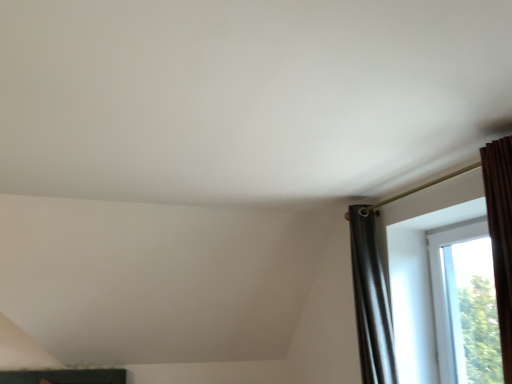
Question: From a real-world perspective, is transparent glass window at right, which appears as the 1th window when viewed from the left, over transparent glass window at right, the 1th window when ordered from right to left?

Choices:
 (A) yes
 (B) no

Answer: (A)

Question: Considering the relative positions of transparent glass window at right, which appears as the 1th window when viewed from the left, and transparent glass window at right, the 1th window when ordered from right to left, in the image provided, is transparent glass window at right, which appears as the 1th window when viewed from the left, in front of transparent glass window at right, the 1th window when ordered from right to left,?

Choices:
 (A) yes
 (B) no

Answer: (A)

Question: Does transparent glass window at right, which appears as the 1th window when viewed from the left, have a lesser height compared to transparent glass window at right, the 1th window when ordered from right to left?

Choices:
 (A) yes
 (B) no

Answer: (B)

Question: Is transparent glass window at right, which ranks as the 2th window in right-to-left order, smaller than transparent glass window at right, the 2th window in the left-to-right sequence?

Choices:
 (A) no
 (B) yes

Answer: (A)

Question: Is transparent glass window at right, which appears as the 1th window when viewed from the left, further to the viewer compared to transparent glass window at right, the 1th window when ordered from right to left?

Choices:
 (A) yes
 (B) no

Answer: (B)

Question: Is transparent glass window at right, which appears as the 1th window when viewed from the left, thinner than transparent glass window at right, the 1th window when ordered from right to left?

Choices:
 (A) yes
 (B) no

Answer: (A)

Question: Does transparent glass window at right, the 1th window when ordered from right to left, have a greater width compared to transparent glass window at right, which ranks as the 2th window in right-to-left order?

Choices:
 (A) no
 (B) yes

Answer: (B)

Question: Is the surface of transparent glass window at right, the 1th window when ordered from right to left, in direct contact with transparent glass window at right, which appears as the 1th window when viewed from the left?

Choices:
 (A) yes
 (B) no

Answer: (B)

Question: Can you confirm if transparent glass window at right, the 1th window when ordered from right to left, is shorter than transparent glass window at right, which ranks as the 2th window in right-to-left order?

Choices:
 (A) no
 (B) yes

Answer: (B)

Question: Is the depth of transparent glass window at right, the 1th window when ordered from right to left, less than that of transparent glass window at right, which appears as the 1th window when viewed from the left?

Choices:
 (A) no
 (B) yes

Answer: (A)

Question: Can you confirm if transparent glass window at right, the 1th window when ordered from right to left, is smaller than transparent glass window at right, which ranks as the 2th window in right-to-left order?

Choices:
 (A) yes
 (B) no

Answer: (A)

Question: Can you confirm if transparent glass window at right, the 2th window in the left-to-right sequence, is taller than transparent glass window at right, which ranks as the 2th window in right-to-left order?

Choices:
 (A) no
 (B) yes

Answer: (A)

Question: Considering their positions, is transparent glass window at right, the 1th window when ordered from right to left, located in front of or behind transparent glass window at right, which appears as the 1th window when viewed from the left?

Choices:
 (A) front
 (B) behind

Answer: (B)